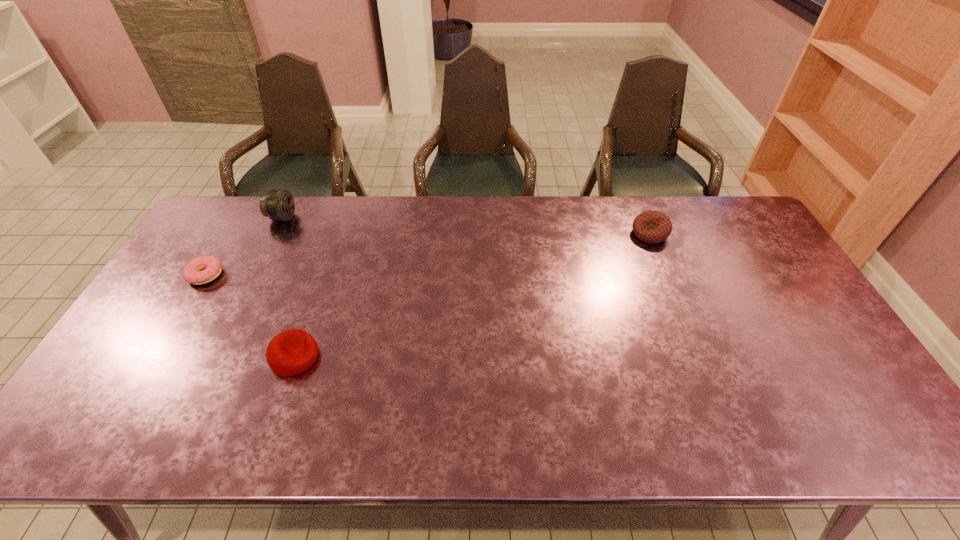
You are a GUI agent. You are given a task and a screenshot of the screen. Output one action in this format:
    pyautogui.click(x=<x>, y=<y>)
    Task: Click on the object that is the second closest to the rightmost object
    The height and width of the screenshot is (540, 960).
    Given the screenshot: What is the action you would take?
    pyautogui.click(x=278, y=205)

Identify which object is the second closest to the telephoto lens. Please provide its 2D coordinates. Your answer should be formatted as a tuple, i.e. [(x, y)], where the tuple contains the x and y coordinates of a point satisfying the conditions above.

[(293, 351)]

Find the location of a particular element. This screenshot has width=960, height=540. free spot that satisfies the following two spatial constraints: 1. on the front-facing side of the telephoto lens; 2. on the front side of the leftmost object is located at coordinates (254, 275).

Locate an element on the screen. This screenshot has width=960, height=540. free space that satisfies the following two spatial constraints: 1. on the front-facing side of the rightmost object; 2. on the right side of the tallest object is located at coordinates (275, 234).

At what (x,y) coordinates should I click in order to perform the action: click on free location that satisfies the following two spatial constraints: 1. on the back side of the farther beanbag; 2. on the left side of the third farthest object. Please return your answer as a coordinate pair (x, y). Image resolution: width=960 pixels, height=540 pixels. Looking at the image, I should click on (230, 234).

At what (x,y) coordinates should I click in order to perform the action: click on vacant region that satisfies the following two spatial constraints: 1. on the front-facing side of the third object from right to left; 2. on the left side of the farther beanbag. Please return your answer as a coordinate pair (x, y). Looking at the image, I should click on (275, 234).